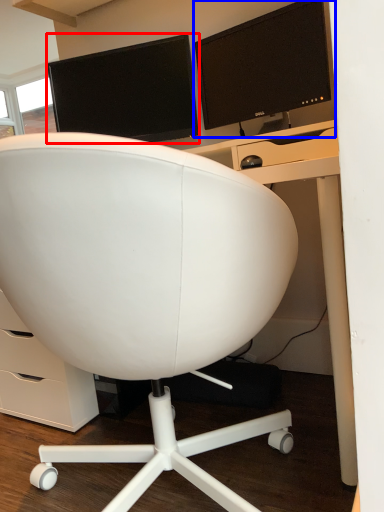
Question: Which object is further to the camera taking this photo, computer monitor (highlighted by a red box) or computer monitor (highlighted by a blue box)?

Choices:
 (A) computer monitor
 (B) computer monitor

Answer: (A)